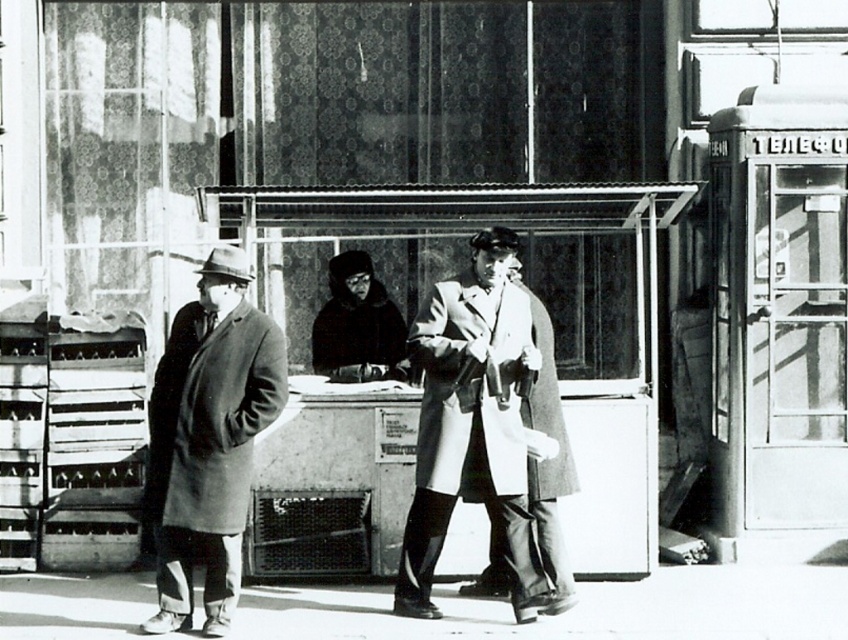
Question: Does matte gray coat at left come behind velvet black coat at center?

Choices:
 (A) no
 (B) yes

Answer: (A)

Question: Which object is closer to the camera taking this photo?

Choices:
 (A) velvet black coat at center
 (B) metallic gray kiosk at center
 (C) light gray wool coat at center

Answer: (C)

Question: Can you confirm if light gray wool coat at center is positioned to the left of matte gray coat at left?

Choices:
 (A) yes
 (B) no

Answer: (B)

Question: Is metallic gray kiosk at center bigger than velvet black coat at center?

Choices:
 (A) yes
 (B) no

Answer: (A)

Question: Which point is farther to the camera?

Choices:
 (A) velvet black coat at center
 (B) light gray wool coat at center

Answer: (A)

Question: Estimate the real-world distances between objects in this image. Which object is closer to the light gray wool coat at center?

Choices:
 (A) matte gray coat at left
 (B) metallic gray kiosk at center
 (C) velvet black coat at center

Answer: (A)